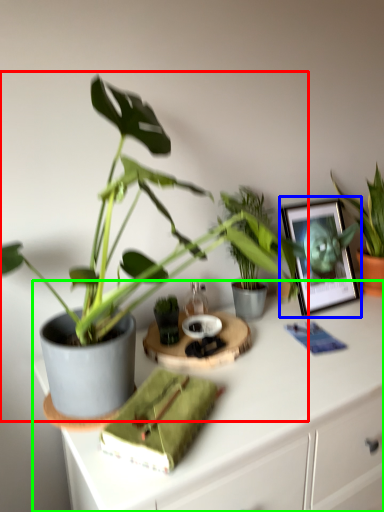
Question: Estimate the real-world distances between objects in this image. Which object is farther from houseplant (highlighted by a red box), picture frame (highlighted by a blue box) or desk (highlighted by a green box)?

Choices:
 (A) picture frame
 (B) desk

Answer: (A)